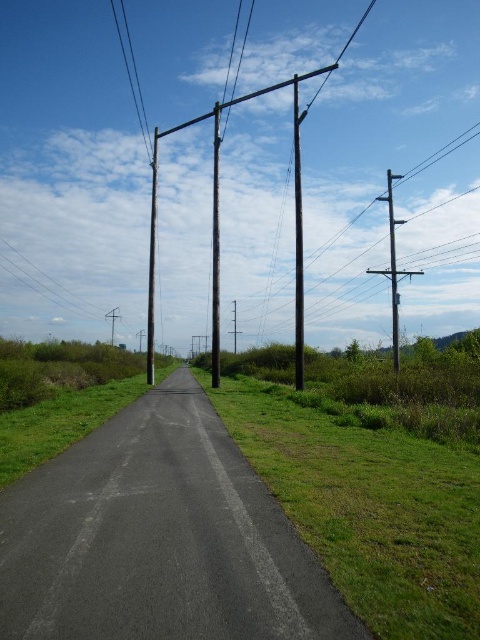
Question: Is black asphalt road at center wider than smooth wire at upper left?

Choices:
 (A) yes
 (B) no

Answer: (B)

Question: Estimate the real-world distances between objects in this image. Which object is closer to the smooth wire at upper left?

Choices:
 (A) black metal pole at center
 (B) green grassy at center
 (C) smooth wood pole at center

Answer: (C)

Question: From the image, what is the correct spatial relationship of black asphalt road at center in relation to smooth wire at upper left?

Choices:
 (A) right
 (B) left

Answer: (A)

Question: Estimate the real-world distances between objects in this image. Which object is farther from the black asphalt road at center?

Choices:
 (A) green grassy at center
 (B) smooth wood telegraph pole at center

Answer: (B)

Question: Estimate the real-world distances between objects in this image. Which object is farther from the black asphalt road at center?

Choices:
 (A) smooth wood telegraph pole at center
 (B) black metal pole at center
 (C) smooth wire at upper left
 (D) smooth wood pole at center

Answer: (C)

Question: Does smooth wire at upper left have a larger size compared to smooth wood telegraph pole at right?

Choices:
 (A) yes
 (B) no

Answer: (B)